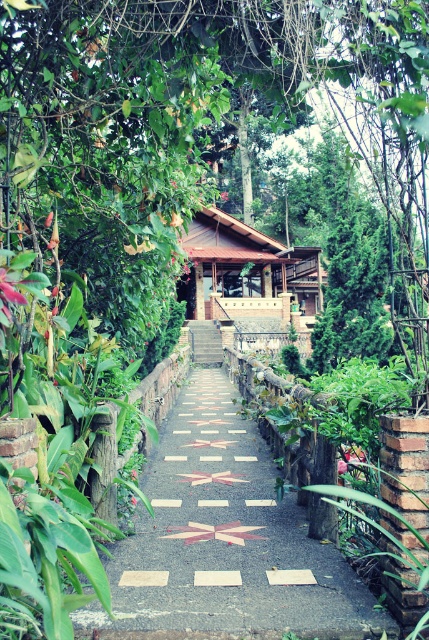
Question: Which point is closer to the camera taking this photo?

Choices:
 (A) (205, 336)
 (B) (374, 156)
 (C) (290, 259)

Answer: (B)

Question: Which object is the closest to the green leafy tree at upper left?

Choices:
 (A) marble-patterned stone path at center
 (B) wooden stairs at center

Answer: (B)

Question: Can you confirm if marble-patterned stone path at center is bigger than brown wooden hut at center?

Choices:
 (A) no
 (B) yes

Answer: (A)

Question: Is green leafy tree at upper left closer to the viewer compared to wooden stairs at center?

Choices:
 (A) yes
 (B) no

Answer: (A)

Question: Which of the following is the closest to the observer?

Choices:
 (A) (213, 324)
 (B) (254, 273)
 (C) (214, 451)
 (D) (87, 88)

Answer: (D)

Question: Does marble-patterned stone path at center have a lesser width compared to wooden stairs at center?

Choices:
 (A) no
 (B) yes

Answer: (A)